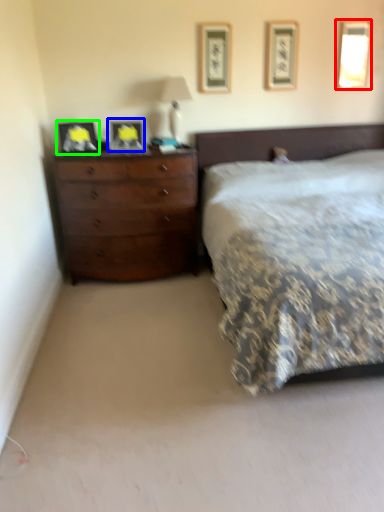
Question: Estimate the real-world distances between objects in this image. Which object is farther from picture frame (highlighted by a red box), picture frame (highlighted by a blue box) or picture frame (highlighted by a green box)?

Choices:
 (A) picture frame
 (B) picture frame

Answer: (B)